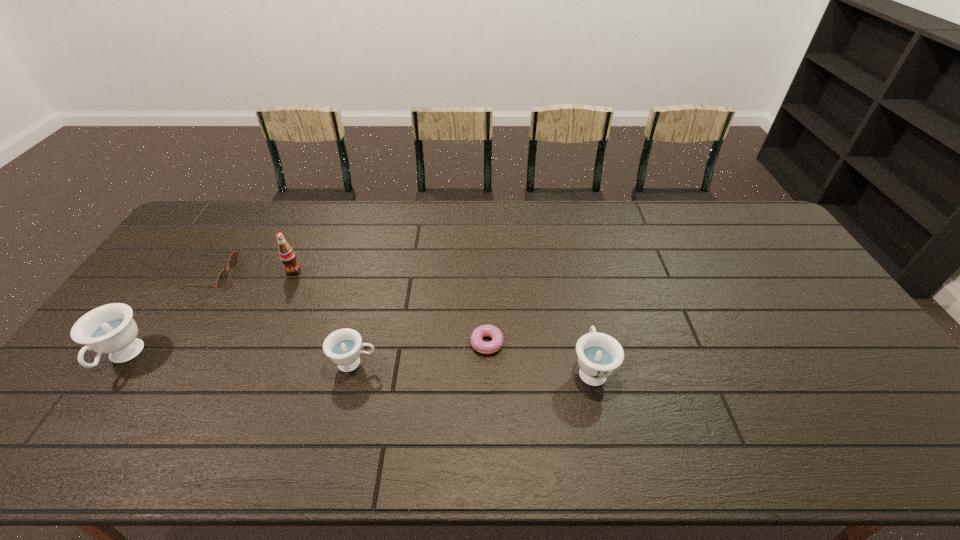
Find the location of a particular element. The height and width of the screenshot is (540, 960). free spot located 0.050m on the side of the leftmost teacup with the handle is located at coordinates (90, 403).

Find the location of a particular element. The width and height of the screenshot is (960, 540). vacant space positioned 0.350m on the side of the second teacup from right to left with the handle is located at coordinates (511, 363).

This screenshot has height=540, width=960. Identify the location of free space located on the side of the rightmost object with the handle. (567, 258).

Identify the location of free space located 0.260m on the side of the rightmost object with the handle. The image size is (960, 540). (572, 279).

Find the location of a particular element. free space located on the side of the rightmost object with the handle is located at coordinates (580, 313).

You are a GUI agent. You are given a task and a screenshot of the screen. Output one action in this format:
    pyautogui.click(x=<x>, y=<y>)
    Task: Click on the vacant space positioned 0.120m on the back of the fourth object from right to left
    The height and width of the screenshot is (540, 960).
    Given the screenshot: What is the action you would take?
    pyautogui.click(x=306, y=243)

Find the location of a particular element. The image size is (960, 540). free space located on the back of the fifth object from left to right is located at coordinates (483, 259).

You are a GUI agent. You are given a task and a screenshot of the screen. Output one action in this format:
    pyautogui.click(x=<x>, y=<y>)
    Task: Click on the vacant space positioned on the face of the fifth tallest object
    The width and height of the screenshot is (960, 540).
    Given the screenshot: What is the action you would take?
    pyautogui.click(x=288, y=275)

I want to click on teacup that is at the left edge, so click(110, 329).

Where is `sunglasses situated at the left edge`? The height and width of the screenshot is (540, 960). sunglasses situated at the left edge is located at coordinates (222, 278).